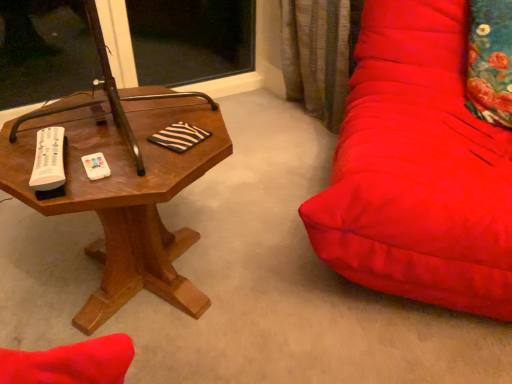
Where is `floral fabric pillow at right`? The image size is (512, 384). floral fabric pillow at right is located at coordinates (490, 62).

Describe the element at coordinates (490, 62) in the screenshot. The image size is (512, 384). I see `floral fabric pillow at right` at that location.

Find the location of a particular element. Image resolution: width=512 pixels, height=384 pixels. woodenobject at left is located at coordinates (124, 196).

Describe the element at coordinates (124, 196) in the screenshot. I see `woodenobject at left` at that location.

I want to click on floral fabric pillow at right, so click(x=490, y=62).

Does woodenobject at left appear on the right side of floral fabric pillow at right?

In fact, woodenobject at left is to the left of floral fabric pillow at right.

Is woodenobject at left in front of or behind floral fabric pillow at right in the image?

In the image, woodenobject at left appears in front of floral fabric pillow at right.

Which is less distant, (97,200) or (490,8)?

Point (97,200).

From the image's perspective, would you say woodenobject at left is positioned over floral fabric pillow at right?

Actually, woodenobject at left appears below floral fabric pillow at right in the image.

From a real-world perspective, who is located lower, woodenobject at left or floral fabric pillow at right?

woodenobject at left.

Consider the image. Which of these two, woodenobject at left or floral fabric pillow at right, is thinner?

floral fabric pillow at right.

Does woodenobject at left have a greater height compared to floral fabric pillow at right?

Yes.

Can you confirm if woodenobject at left is smaller than floral fabric pillow at right?

Incorrect, woodenobject at left is not smaller in size than floral fabric pillow at right.

Would you say woodenobject at left contains floral fabric pillow at right?

That's incorrect, floral fabric pillow at right is not inside woodenobject at left.

Is woodenobject at left far away from floral fabric pillow at right?

Yes, woodenobject at left and floral fabric pillow at right are quite far apart.

Is woodenobject at left oriented towards floral fabric pillow at right?

No, woodenobject at left is not oriented towards floral fabric pillow at right.

How different are the orientations of woodenobject at left and floral fabric pillow at right in degrees?

70.4 degrees.

Identify the location of table lying below the floral fabric pillow at right (from the image's perspective). The width and height of the screenshot is (512, 384). (124, 196).

Can you confirm if floral fabric pillow at right is positioned to the right of woodenobject at left?

Yes.

Relative to woodenobject at left, is floral fabric pillow at right in front or behind?

Visually, floral fabric pillow at right is located behind woodenobject at left.

Between point (487, 82) and point (220, 128), which one is positioned in front?

The point (220, 128) is closer to the camera.

From the image's perspective, between floral fabric pillow at right and woodenobject at left, which one is located above?

floral fabric pillow at right appears higher in the image.

From a real-world perspective, who is located lower, floral fabric pillow at right or woodenobject at left?

From a 3D spatial view, woodenobject at left is below.

Considering the sizes of objects floral fabric pillow at right and woodenobject at left in the image provided, who is thinner, floral fabric pillow at right or woodenobject at left?

floral fabric pillow at right.

Considering the sizes of objects floral fabric pillow at right and woodenobject at left in the image provided, who is taller, floral fabric pillow at right or woodenobject at left?

woodenobject at left is taller.

Which of these two, floral fabric pillow at right or woodenobject at left, is smaller?

floral fabric pillow at right.

Do you think floral fabric pillow at right is within woodenobject at left, or outside of it?

The correct answer is: outside.

Is floral fabric pillow at right placed right next to woodenobject at left?

They are not placed beside each other.

Is floral fabric pillow at right oriented towards woodenobject at left?

No, floral fabric pillow at right is not aimed at woodenobject at left.

The width and height of the screenshot is (512, 384). Identify the location of throw pillow that appears on the right of woodenobject at left. (490, 62).

In order to click on throw pillow above the woodenobject at left (from a real-world perspective) in this screenshot , I will do `click(490, 62)`.

This screenshot has height=384, width=512. Find the location of `throw pillow that appears on the right of woodenobject at left`. throw pillow that appears on the right of woodenobject at left is located at coordinates (490, 62).